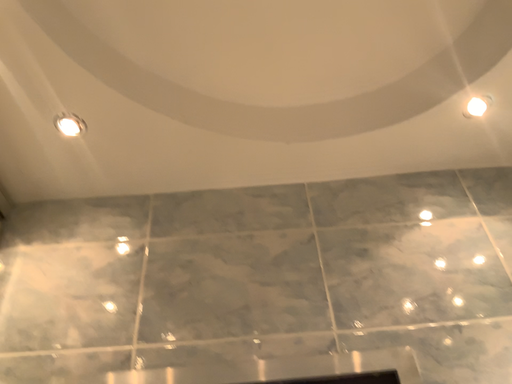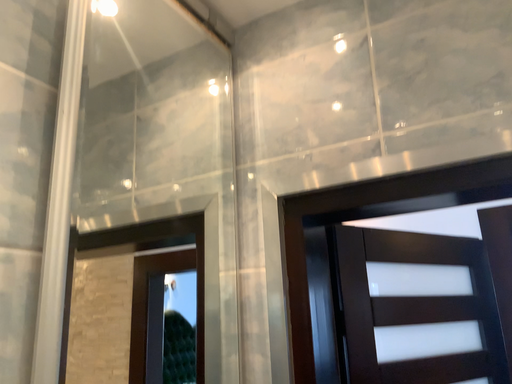
Question: How did the camera likely rotate when shooting the video?

Choices:
 (A) rotated upward
 (B) rotated downward

Answer: (B)